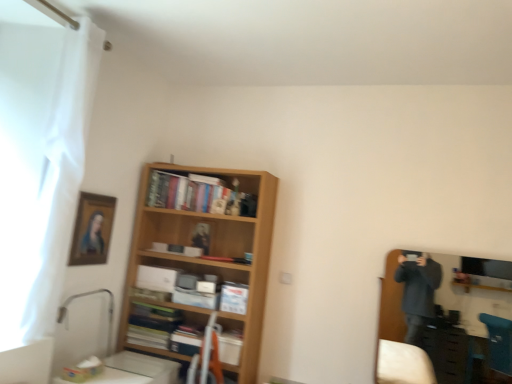
Question: Can you confirm if wooden bookshelf at center is thinner than wooden entertainment center at right?

Choices:
 (A) no
 (B) yes

Answer: (A)

Question: Is wooden bookshelf at center located outside wooden entertainment center at right?

Choices:
 (A) yes
 (B) no

Answer: (A)

Question: Is wooden bookshelf at center turned away from wooden entertainment center at right?

Choices:
 (A) yes
 (B) no

Answer: (B)

Question: Is wooden bookshelf at center not close to wooden entertainment center at right?

Choices:
 (A) no
 (B) yes

Answer: (B)

Question: Is the surface of wooden bookshelf at center in direct contact with wooden entertainment center at right?

Choices:
 (A) no
 (B) yes

Answer: (A)

Question: Considering the positions of point (56, 208) and point (143, 198), is point (56, 208) closer or farther from the camera than point (143, 198)?

Choices:
 (A) closer
 (B) farther

Answer: (A)

Question: Looking at the image, does white sheer curtain at left seem bigger or smaller compared to wooden bookshelf at center?

Choices:
 (A) small
 (B) big

Answer: (A)

Question: Relative to wooden bookshelf at center, is white sheer curtain at left in front or behind?

Choices:
 (A) front
 (B) behind

Answer: (A)

Question: From the image's perspective, is white sheer curtain at left above or below wooden bookshelf at center?

Choices:
 (A) above
 (B) below

Answer: (A)

Question: Is wooden bookshelf at center bigger or smaller than matte orange bookshelf at center, the second book viewed from the top?

Choices:
 (A) small
 (B) big

Answer: (B)

Question: Considering their positions, is wooden bookshelf at center located in front of or behind matte orange bookshelf at center, arranged as the 1th book when viewed from the front?

Choices:
 (A) behind
 (B) front

Answer: (A)

Question: Based on their positions, is wooden bookshelf at center located to the left or right of matte orange bookshelf at center, the second book viewed from the top?

Choices:
 (A) right
 (B) left

Answer: (B)

Question: Choose the correct answer: Is wooden bookshelf at center inside matte orange bookshelf at center, which is counted as the 2th book, starting from the back, or outside it?

Choices:
 (A) inside
 (B) outside

Answer: (B)

Question: From a real-world perspective, is matte orange bookshelf at center, the second book viewed from the top, above or below wooden framed portrait at upper left?

Choices:
 (A) below
 (B) above

Answer: (A)

Question: Relative to wooden framed portrait at upper left, is matte orange bookshelf at center, the second book viewed from the top, in front or behind?

Choices:
 (A) front
 (B) behind

Answer: (A)